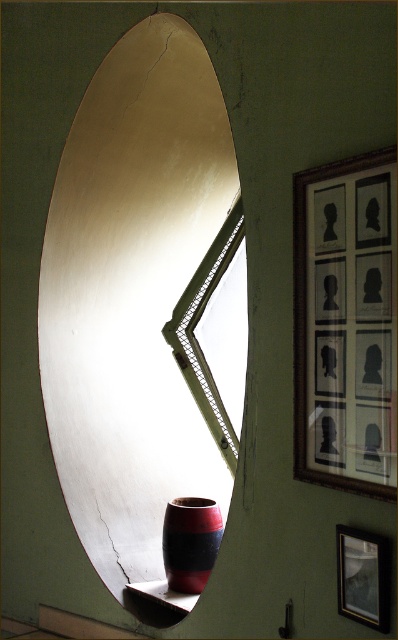
You are an interior designer assessing the placement of the matte red and black vase at lower center and the silvery metallic picture frame at upper right. Based on their positions, which object is closer to the viewer?

The matte red and black vase at lower center is closer to the viewer because the silvery metallic picture frame at upper right is behind it.

You are an interior designer assessing the space. You need to determine which object is taller between the metallic gold mirror at center and the silvery metallic picture frame at upper right. Based on the scene, which one is taller?

The metallic gold mirror at center is taller than the silvery metallic picture frame at upper right.